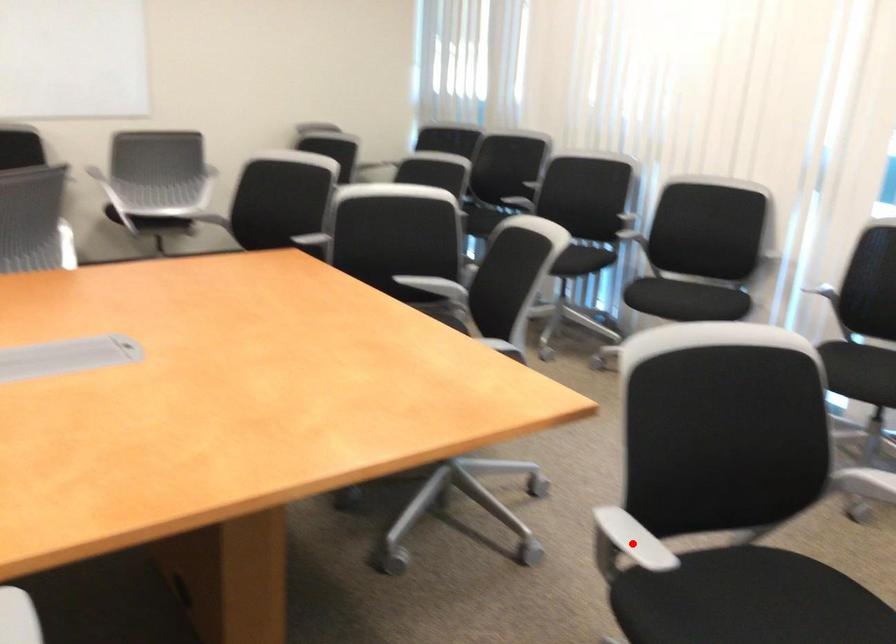
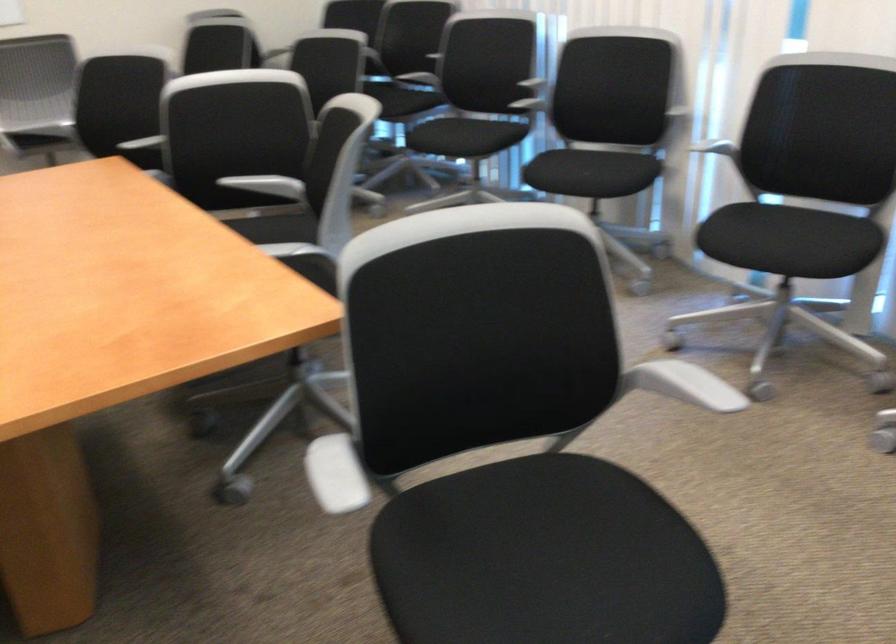
Question: I am providing you with two images of the same scene from different viewpoints. A red point is shown in image1. For the corresponding object point in image2, is it positioned nearer or farther from the camera?

Choices:
 (A) Nearer
 (B) Farther

Answer: (A)